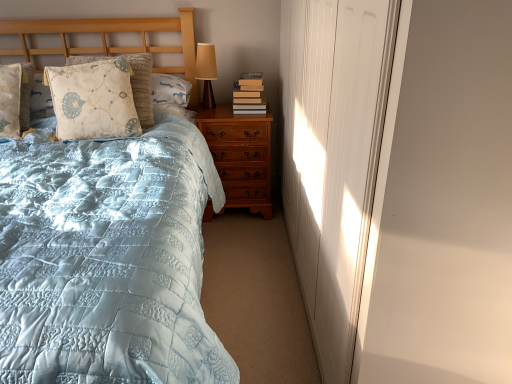
Identify the location of hardcover books at right. This screenshot has height=384, width=512. (249, 95).

Where is `matte brown table lamp at upper center`? The width and height of the screenshot is (512, 384). matte brown table lamp at upper center is located at coordinates (206, 72).

Locate an element on the screen. This screenshot has height=384, width=512. light blue quilted bed at left is located at coordinates (106, 261).

What do you see at coordinates (333, 155) in the screenshot? I see `white matte door at right` at bounding box center [333, 155].

Image resolution: width=512 pixels, height=384 pixels. What are the coordinates of `fluffy beige pillow at left, the second pillow viewed from the right` in the screenshot? It's located at (15, 98).

Measure the distance between light brown wood nightstand at center and camera.

The depth of light brown wood nightstand at center is 2.40 meters.

Locate an element on the screen. This screenshot has height=384, width=512. hardcover books at right is located at coordinates (249, 95).

Is white matte door at right further to camera compared to floral-patterned fabric pillow at upper left, which is the first pillow from right to left?

No, it is in front of floral-patterned fabric pillow at upper left, which is the first pillow from right to left.

Is white matte door at right next to floral-patterned fabric pillow at upper left, which is the first pillow from right to left, and touching it?

white matte door at right and floral-patterned fabric pillow at upper left, which is the first pillow from right to left, are clearly separated.

Considering the points (345, 228) and (86, 94), which point is behind, point (345, 228) or point (86, 94)?

The point (86, 94) is more distant.

From a real-world perspective, is white matte door at right positioned under floral-patterned fabric pillow at upper left, which is the first pillow from right to left, based on gravity?

Indeed, from a real-world perspective, white matte door at right is positioned beneath floral-patterned fabric pillow at upper left, which is the first pillow from right to left.

Considering the sizes of objects floral-patterned fabric pillow at upper left, which is the first pillow from right to left, and light brown wood nightstand at center in the image provided, who is thinner, floral-patterned fabric pillow at upper left, which is the first pillow from right to left, or light brown wood nightstand at center?

floral-patterned fabric pillow at upper left, which is the first pillow from right to left, is thinner.

Which object is closer to the camera, floral-patterned fabric pillow at upper left, the second pillow from the left, or light brown wood nightstand at center?

floral-patterned fabric pillow at upper left, the second pillow from the left.

Is floral-patterned fabric pillow at upper left, the second pillow from the left, far from light brown wood nightstand at center?

No, floral-patterned fabric pillow at upper left, the second pillow from the left, is not far away from light brown wood nightstand at center.

Does point (212, 59) appear closer or farther from the camera than point (246, 78)?

Point (212, 59) is farther from the camera than point (246, 78).

What's the angular difference between matte brown table lamp at upper center and hardcover books at right's facing directions?

6.12e-05 degrees separate the facing orientations of matte brown table lamp at upper center and hardcover books at right.

In the scene shown: In the image, is matte brown table lamp at upper center positioned in front of or behind hardcover books at right?

matte brown table lamp at upper center is behind hardcover books at right.

From a real-world perspective, is matte brown table lamp at upper center below hardcover books at right?

No, from a real-world perspective, matte brown table lamp at upper center is not below hardcover books at right.

Choose the correct answer: Is fluffy beige pillow at left, which ranks as the first pillow in left-to-right order, inside floral-patterned fabric pillow at upper left, the second pillow from the left, or outside it?

fluffy beige pillow at left, which ranks as the first pillow in left-to-right order, exists outside the volume of floral-patterned fabric pillow at upper left, the second pillow from the left.

Which is in front, fluffy beige pillow at left, which ranks as the first pillow in left-to-right order, or floral-patterned fabric pillow at upper left, which is the first pillow from right to left?

Positioned in front is fluffy beige pillow at left, which ranks as the first pillow in left-to-right order.

Is fluffy beige pillow at left, the second pillow viewed from the right, aimed at floral-patterned fabric pillow at upper left, the second pillow from the left?

No, fluffy beige pillow at left, the second pillow viewed from the right, is not facing towards floral-patterned fabric pillow at upper left, the second pillow from the left.

Considering the relative sizes of fluffy beige pillow at left, the second pillow viewed from the right, and floral-patterned fabric pillow at upper left, the second pillow from the left, in the image provided, is fluffy beige pillow at left, the second pillow viewed from the right, smaller than floral-patterned fabric pillow at upper left, the second pillow from the left,?

Indeed, fluffy beige pillow at left, the second pillow viewed from the right, has a smaller size compared to floral-patterned fabric pillow at upper left, the second pillow from the left.

There is a hardcover books at right. At what (x,y) coordinates should I click in order to perform the action: click on the 1st pillow above it (from a real-world perspective). Please return your answer as a coordinate pair (x, y). Image resolution: width=512 pixels, height=384 pixels. Looking at the image, I should click on (15, 98).

Looking at this image, can hardcover books at right be found inside fluffy beige pillow at left, the second pillow viewed from the right?

Actually, hardcover books at right is outside fluffy beige pillow at left, the second pillow viewed from the right.

Considering the sizes of fluffy beige pillow at left, the second pillow viewed from the right, and hardcover books at right in the image, is fluffy beige pillow at left, the second pillow viewed from the right, taller or shorter than hardcover books at right?

Clearly, fluffy beige pillow at left, the second pillow viewed from the right, is taller compared to hardcover books at right.

Where is `table lamp above the light blue quilted bed at left (from a real-world perspective)`? The height and width of the screenshot is (384, 512). table lamp above the light blue quilted bed at left (from a real-world perspective) is located at coordinates (206, 72).

From a real-world perspective, is matte brown table lamp at upper center above or below light blue quilted bed at left?

From a real-world perspective, matte brown table lamp at upper center is physically above light blue quilted bed at left.

Based on the photo, is matte brown table lamp at upper center wider or thinner than light blue quilted bed at left?

In the image, matte brown table lamp at upper center appears to be more narrow than light blue quilted bed at left.

Between matte brown table lamp at upper center and light blue quilted bed at left, which one has smaller size?

matte brown table lamp at upper center.

Is point (251, 108) more distant than point (74, 117)?

Yes, it is behind point (74, 117).

From a real-world perspective, is hardcover books at right physically above floral-patterned fabric pillow at upper left, which is the first pillow from right to left?

Incorrect, from a real-world perspective, hardcover books at right is lower than floral-patterned fabric pillow at upper left, which is the first pillow from right to left.

Considering the sizes of hardcover books at right and floral-patterned fabric pillow at upper left, which is the first pillow from right to left, in the image, is hardcover books at right taller or shorter than floral-patterned fabric pillow at upper left, which is the first pillow from right to left,?

Considering their sizes, hardcover books at right has less height than floral-patterned fabric pillow at upper left, which is the first pillow from right to left.

From a real-world perspective, count 2nd pillows upward from the white matte door at right and point to it. Please provide its 2D coordinates.

[(93, 100)]

Image resolution: width=512 pixels, height=384 pixels. Identify the location of nightstand that appears below the floral-patterned fabric pillow at upper left, which is the first pillow from right to left (from the image's perspective). (240, 156).

Looking at the image, which one is located further to light brown wood nightstand at center, hardcover books at right or white matte door at right?

Based on the image, white matte door at right appears to be further to light brown wood nightstand at center.

Estimate the real-world distances between objects in this image. Which object is further from floral-patterned fabric pillow at upper left, the second pillow from the left, light brown wood nightstand at center or fluffy beige pillow at left, the second pillow viewed from the right?

light brown wood nightstand at center.

Looking at the image, which one is located closer to floral-patterned fabric pillow at upper left, the second pillow from the left, matte brown table lamp at upper center or light brown wood nightstand at center?

matte brown table lamp at upper center lies closer to floral-patterned fabric pillow at upper left, the second pillow from the left, than the other object.

Based on their spatial positions, is light blue quilted bed at left or white matte door at right further from matte brown table lamp at upper center?

Among the two, white matte door at right is located further to matte brown table lamp at upper center.

Which object lies nearer to the anchor point matte brown table lamp at upper center, hardcover books at right or fluffy beige pillow at left, the second pillow viewed from the right?

The object closer to matte brown table lamp at upper center is hardcover books at right.

From the image, which object appears to be farther from light brown wood nightstand at center, light blue quilted bed at left or hardcover books at right?

The object further to light brown wood nightstand at center is light blue quilted bed at left.

From the image, which object appears to be nearer to white matte door at right, matte brown table lamp at upper center or fluffy beige pillow at left, which ranks as the first pillow in left-to-right order?

matte brown table lamp at upper center lies closer to white matte door at right than the other object.

Which object lies nearer to the anchor point light blue quilted bed at left, matte brown table lamp at upper center or fluffy beige pillow at left, the second pillow viewed from the right?

Among the two, fluffy beige pillow at left, the second pillow viewed from the right, is located nearer to light blue quilted bed at left.

You are a GUI agent. You are given a task and a screenshot of the screen. Output one action in this format:
    pyautogui.click(x=<x>, y=<y>)
    Task: Click on the nightstand between light blue quilted bed at left and matte brown table lamp at upper center in the front-back direction
    
    Given the screenshot: What is the action you would take?
    pyautogui.click(x=240, y=156)

Locate an element on the screen. nightstand between floral-patterned fabric pillow at upper left, which is the first pillow from right to left, and hardcover books at right, in the horizontal direction is located at coordinates pos(240,156).

Locate an element on the screen. This screenshot has height=384, width=512. nightstand between white matte door at right and matte brown table lamp at upper center in the front-back direction is located at coordinates (240, 156).

Where is `book positioned between light blue quilted bed at left and matte brown table lamp at upper center from near to far`? Image resolution: width=512 pixels, height=384 pixels. book positioned between light blue quilted bed at left and matte brown table lamp at upper center from near to far is located at coordinates (249, 95).